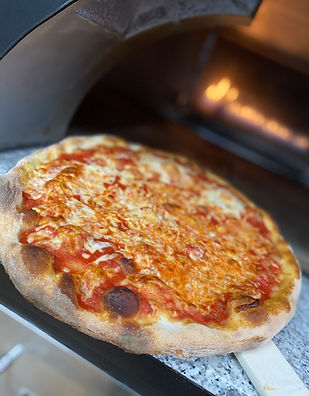
You are a GUI agent. You are given a task and a screenshot of the screen. Output one action in this format:
    pyautogui.click(x=<x>, y=<y>)
    Task: Click on the wooden plank
    The height and width of the screenshot is (396, 309).
    Given the screenshot: What is the action you would take?
    tap(273, 364)